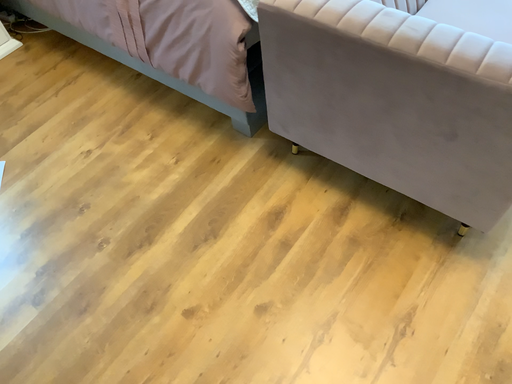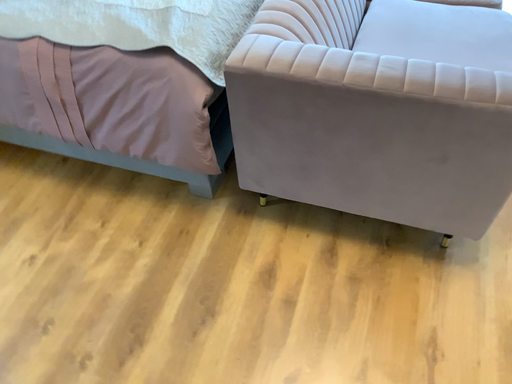
Question: How did the camera likely rotate when shooting the video?

Choices:
 (A) rotated upward
 (B) rotated downward

Answer: (A)